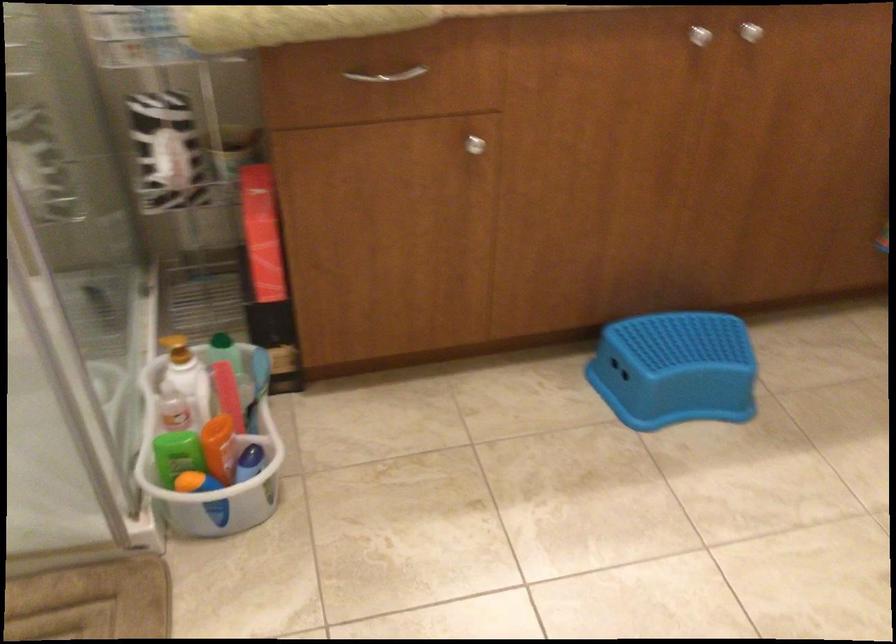
Where would you lift the white plastic basket? Please return your answer as a coordinate pair (x, y).

(208, 439)